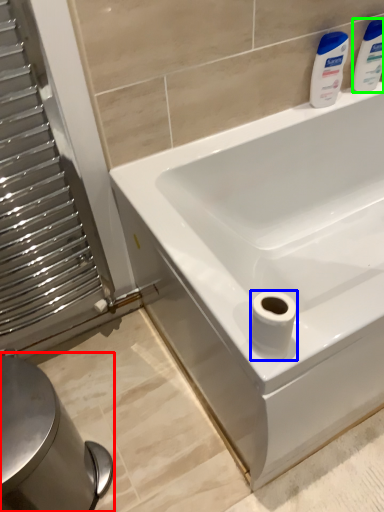
Question: Considering the real-world distances, which object is closest to bidet (highlighted by a red box)? toilet paper (highlighted by a blue box) or cleaning product (highlighted by a green box).

Choices:
 (A) toilet paper
 (B) cleaning product

Answer: (A)